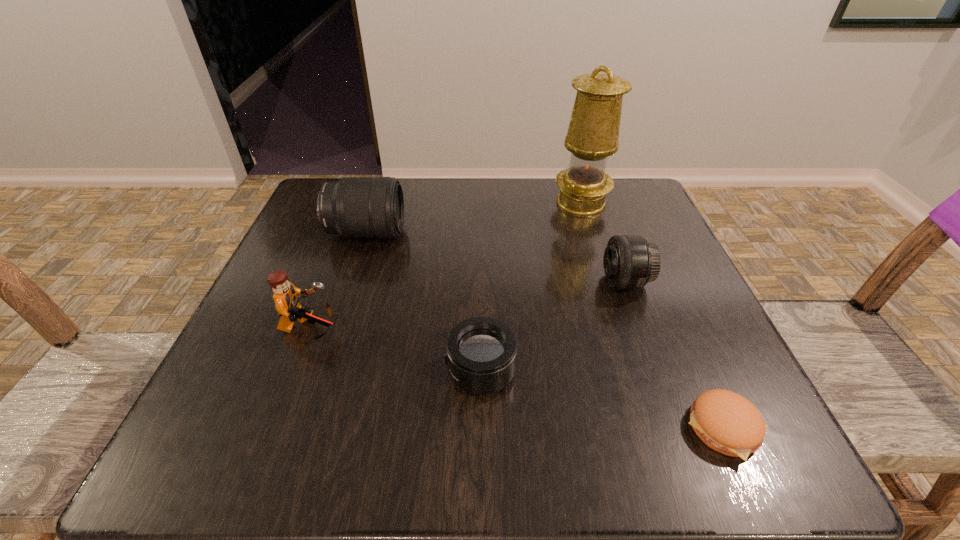
Identify the location of free location that satisfies the following two spatial constraints: 1. on the front side of the tallest object; 2. on the surface of the farthest telephoto lens. (x=590, y=233).

At what (x,y) coordinates should I click in order to perform the action: click on free space that satisfies the following two spatial constraints: 1. on the front-facing side of the third shortest object; 2. on the back side of the patty. Please return your answer as a coordinate pair (x, y). Looking at the image, I should click on (677, 428).

Image resolution: width=960 pixels, height=540 pixels. Identify the location of blank space that satisfies the following two spatial constraints: 1. on the side of the shortest telephoto lens with brand markings and control switches; 2. on the back side of the patty. (481, 428).